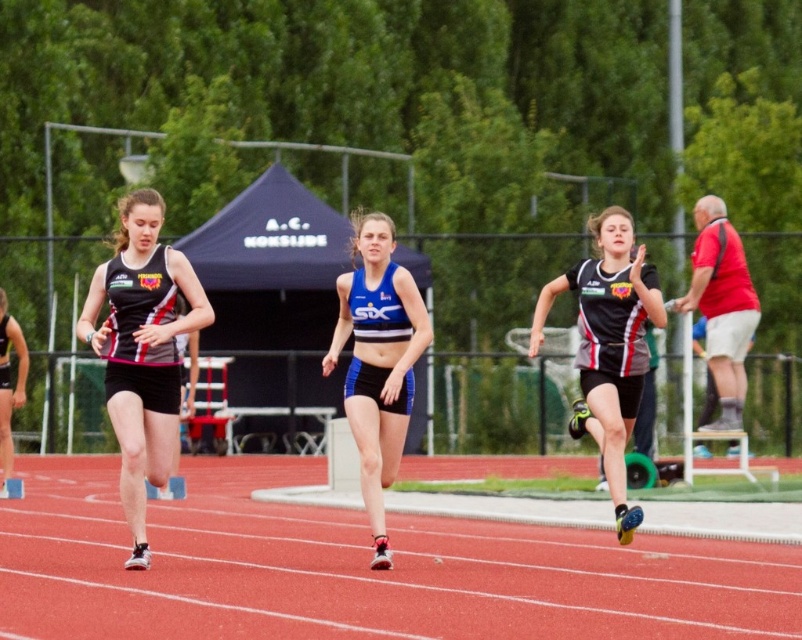
Who is shorter, black matte running uniform at left or black matte running suit at center?

With less height is black matte running suit at center.

Can you confirm if black matte running uniform at left is positioned to the left of black matte running suit at center?

Yes, black matte running uniform at left is to the left of black matte running suit at center.

Locate an element on the screen. black matte running uniform at left is located at coordinates (142, 349).

The height and width of the screenshot is (640, 802). I want to click on black matte running uniform at left, so click(142, 349).

Is blue matte shorts at center below black matte running suit at center?

No.

Which is more to the left, blue matte shorts at center or black matte running suit at center?

Positioned to the left is blue matte shorts at center.

Which is in front, point (375, 365) or point (606, 314)?

Point (375, 365)

This screenshot has height=640, width=802. Identify the location of blue matte shorts at center. coord(377,360).

Is point (557, 529) closer to viewer compared to point (634, 289)?

No, it is not.

Find the location of a particular element. red rubber track at center is located at coordinates (357, 570).